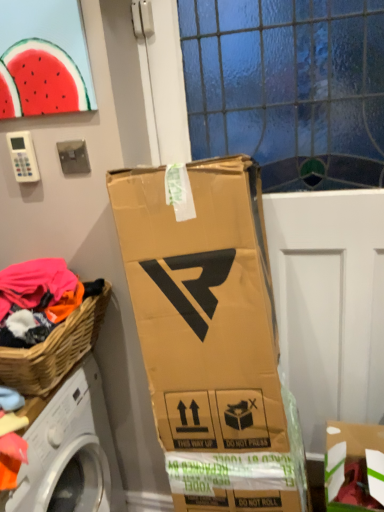
Measure the distance between white plastic washing machine at lower left and camera.

white plastic washing machine at lower left and camera are 36.02 inches apart from each other.

This screenshot has width=384, height=512. What are the coordinates of `white plastic washing machine at lower left` in the screenshot? It's located at (68, 450).

Which point is more forward, (57, 379) or (35, 79)?

Positioned in front is point (57, 379).

Can you confirm if woven wood picnic basket at lower left is shorter than watermelon at upper left?

Yes.

How different are the orientations of woven wood picnic basket at lower left and watermelon at upper left in degrees?

90.1 degrees.

Which object is thinner, woven wood picnic basket at lower left or watermelon at upper left?

Thinner between the two is watermelon at upper left.

Is woven wood picnic basket at lower left further to camera compared to white plastic washing machine at lower left?

That is True.

Does woven wood picnic basket at lower left have a larger size compared to white plastic washing machine at lower left?

Actually, woven wood picnic basket at lower left might be smaller than white plastic washing machine at lower left.

From the image's perspective, is woven wood picnic basket at lower left beneath white plastic washing machine at lower left?

No.

Which of these two, woven wood picnic basket at lower left or white plastic washing machine at lower left, is thinner?

A: woven wood picnic basket at lower left.

Is watermelon at upper left bigger or smaller than transparent glass door at center?

Result: Considering their sizes, watermelon at upper left takes up less space than transparent glass door at center.

Considering the points (49, 69) and (303, 96), which point is in front, point (49, 69) or point (303, 96)?

Point (49, 69)

Could you tell me if watermelon at upper left is turned towards transparent glass door at center?

No, watermelon at upper left does not turn towards transparent glass door at center.

Is transparent glass door at center thinner than woven wood picnic basket at lower left?

Yes, transparent glass door at center is thinner than woven wood picnic basket at lower left.

Is transparent glass door at center positioned with its back to woven wood picnic basket at lower left?

No.

How different are the orientations of transparent glass door at center and woven wood picnic basket at lower left in degrees?

The facing directions of transparent glass door at center and woven wood picnic basket at lower left are 89.5 degrees apart.

Which object is closer to the camera, transparent glass door at center or woven wood picnic basket at lower left?

woven wood picnic basket at lower left is more forward.

From a real-world perspective, is cardboard box at lower right above or below watermelon at upper left?

Clearly, from a real-world perspective, cardboard box at lower right is below watermelon at upper left.

Can you confirm if cardboard box at lower right is thinner than watermelon at upper left?

In fact, cardboard box at lower right might be wider than watermelon at upper left.

Is point (362, 431) farther from camera compared to point (21, 51)?

Yes, it is behind point (21, 51).

Is cardboard box at lower right not near watermelon at upper left?

Yes.

From a real-world perspective, between watermelon at upper left and white plastic washing machine at lower left, who is vertically lower?

From a 3D spatial view, white plastic washing machine at lower left is below.

From the image's perspective, which is below, watermelon at upper left or white plastic washing machine at lower left?

white plastic washing machine at lower left appears lower in the image.

At what (x,y) coordinates should I click in order to perform the action: click on washing machine to the left of watermelon at upper left. Please return your answer as a coordinate pair (x, y). Looking at the image, I should click on (68, 450).

From the image's perspective, is woven wood picnic basket at lower left located above or below transparent glass door at center?

woven wood picnic basket at lower left is situated lower than transparent glass door at center in the image.

Considering the positions of point (74, 351) and point (240, 99), is point (74, 351) closer or farther from the camera than point (240, 99)?

Point (74, 351) is positioned closer to the camera compared to point (240, 99).

At what (x,y) coordinates should I click in order to perform the action: click on glass door that appears behind the woven wood picnic basket at lower left. Please return your answer as a coordinate pair (x, y). The image size is (384, 512). Looking at the image, I should click on (288, 88).

In order to click on watermelon above the woven wood picnic basket at lower left (from a real-world perspective) in this screenshot , I will do `click(41, 81)`.

You are a GUI agent. You are given a task and a screenshot of the screen. Output one action in this format:
    pyautogui.click(x=<x>, y=<y>)
    Task: Click on the picnic basket above the white plastic washing machine at lower left (from the image's perspective)
    This screenshot has width=384, height=512.
    Given the screenshot: What is the action you would take?
    pyautogui.click(x=55, y=350)

When comparing their distances from cardboard box at lower right, does white plastic washing machine at lower left or watermelon at upper left seem further?

watermelon at upper left.

When comparing their distances from watermelon at upper left, does cardboard box at lower right or transparent glass door at center seem further?

cardboard box at lower right lies further to watermelon at upper left than the other object.

When comparing their distances from woven wood picnic basket at lower left, does cardboard box at lower right or white plastic washing machine at lower left seem further?

cardboard box at lower right.

Based on their spatial positions, is transparent glass door at center or white plastic washing machine at lower left closer to watermelon at upper left?

transparent glass door at center lies closer to watermelon at upper left than the other object.

From the image, which object appears to be nearer to white plastic washing machine at lower left, cardboard box at lower right or transparent glass door at center?

cardboard box at lower right is closer to white plastic washing machine at lower left.

Estimate the real-world distances between objects in this image. Which object is closer to woven wood picnic basket at lower left, white plastic washing machine at lower left or cardboard box at lower right?

The object closer to woven wood picnic basket at lower left is white plastic washing machine at lower left.

Considering their positions, is white plastic washing machine at lower left positioned closer to transparent glass door at center than cardboard box at lower right?

Among the two, cardboard box at lower right is located nearer to transparent glass door at center.

When comparing their distances from watermelon at upper left, does transparent glass door at center or woven wood picnic basket at lower left seem further?

transparent glass door at center is further to watermelon at upper left.

Identify the location of glass door between woven wood picnic basket at lower left and cardboard box at lower right in the horizontal direction. Image resolution: width=384 pixels, height=512 pixels. (288, 88).

Find the location of a particular element. The height and width of the screenshot is (512, 384). picnic basket between watermelon at upper left and white plastic washing machine at lower left from top to bottom is located at coordinates (55, 350).

The width and height of the screenshot is (384, 512). I want to click on glass door between watermelon at upper left and white plastic washing machine at lower left in the vertical direction, so click(x=288, y=88).

I want to click on picnic basket between white plastic washing machine at lower left and cardboard box at lower right in the horizontal direction, so click(55, 350).